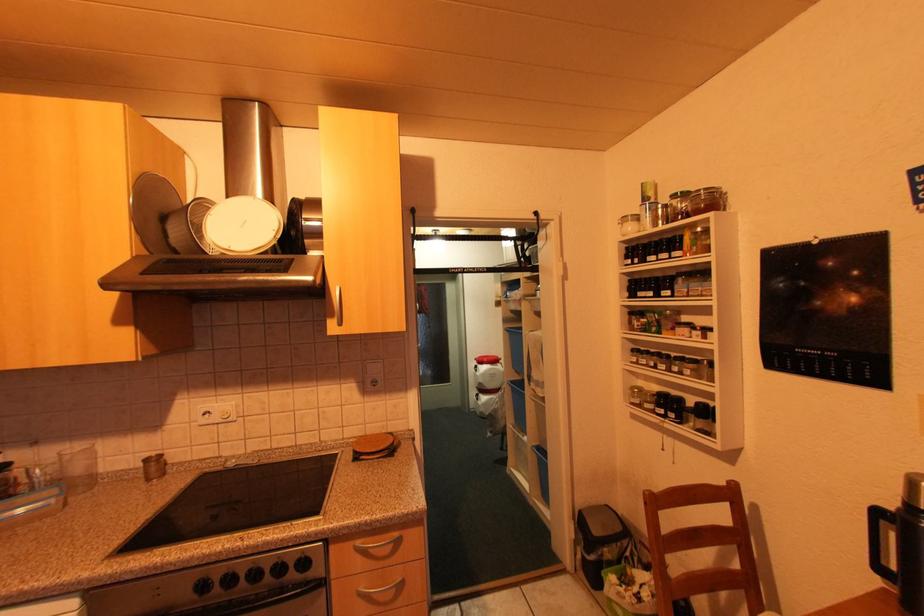
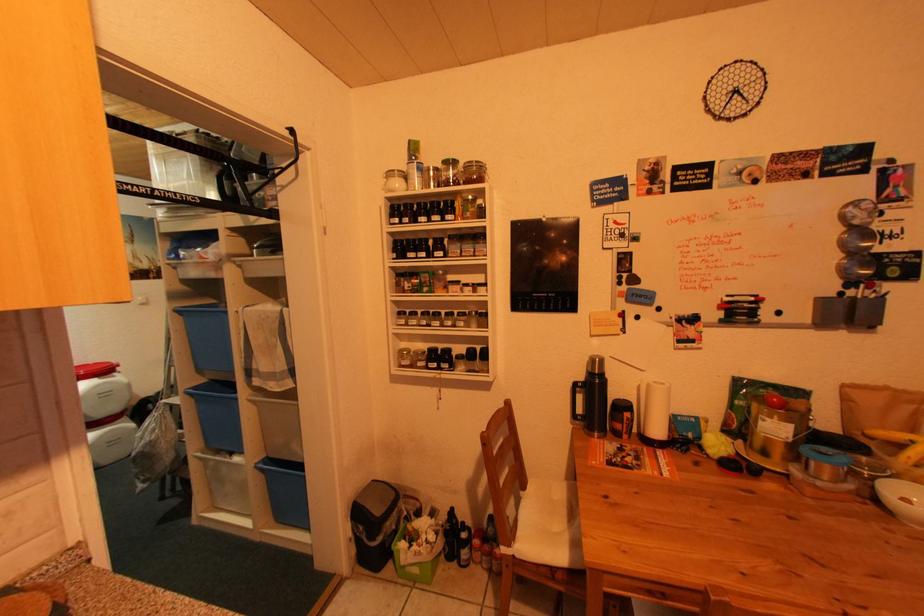
Question: How did the camera likely rotate?

Choices:
 (A) Left
 (B) Right
 (C) Up
 (D) Down

Answer: (B)